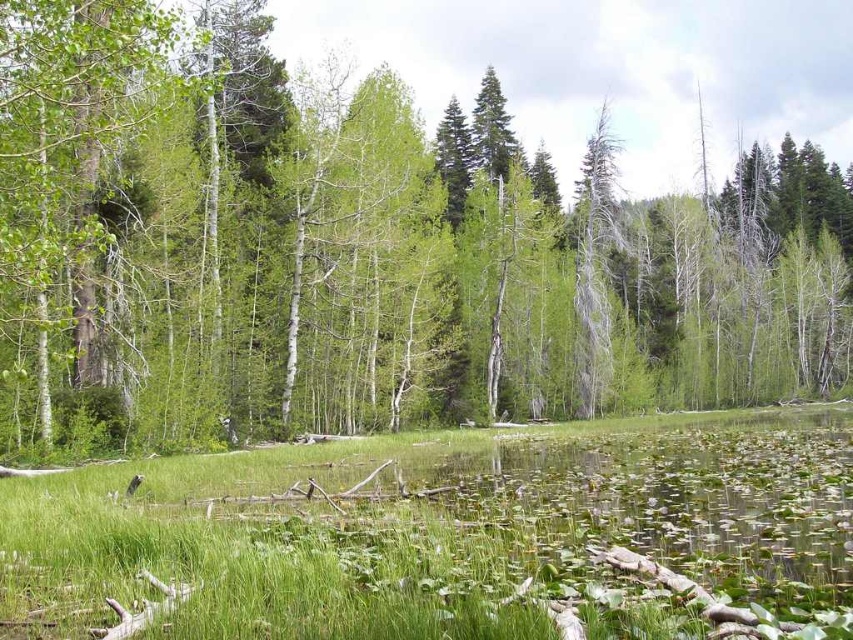
In the scene shown: Can you confirm if green matte tree at center is positioned below green grass at center?

Actually, green matte tree at center is above green grass at center.

Between point (144, 387) and point (55, 602), which one is positioned behind?

The point (144, 387) is more distant.

Which is in front, point (410, 161) or point (392, 444)?

Positioned in front is point (392, 444).

The width and height of the screenshot is (853, 640). I want to click on green matte tree at center, so click(x=368, y=248).